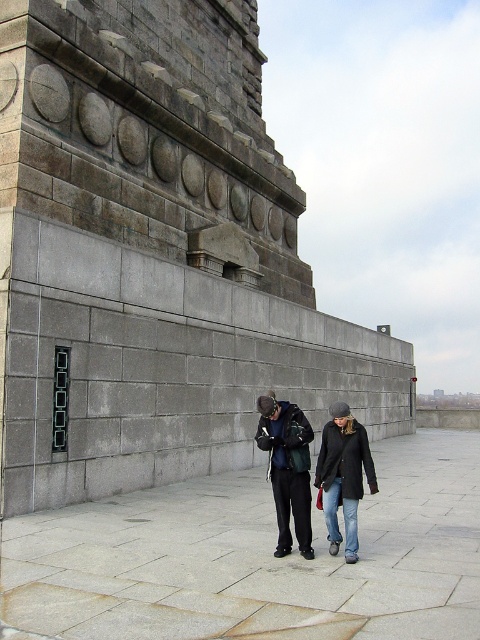
Question: Estimate the real-world distances between objects in this image. Which object is farther from the dark gray fabric jacket at center?

Choices:
 (A) gray stone monument at center
 (B) denim jacket at lower right
 (C) matte black jacket at center

Answer: (A)

Question: Does gray stone monument at center have a larger size compared to denim jacket at lower right?

Choices:
 (A) no
 (B) yes

Answer: (B)

Question: Among these objects, which one is farthest from the camera?

Choices:
 (A) dark gray fabric jacket at center
 (B) denim jacket at lower right
 (C) gray stone monument at center

Answer: (C)

Question: Is matte black jacket at center positioned at the back of dark gray fabric jacket at center?

Choices:
 (A) yes
 (B) no

Answer: (B)

Question: Which object appears farthest from the camera in this image?

Choices:
 (A) denim jacket at lower right
 (B) dark gray fabric jacket at center

Answer: (B)

Question: Is gray stone monument at center smaller than dark gray fabric jacket at center?

Choices:
 (A) no
 (B) yes

Answer: (A)